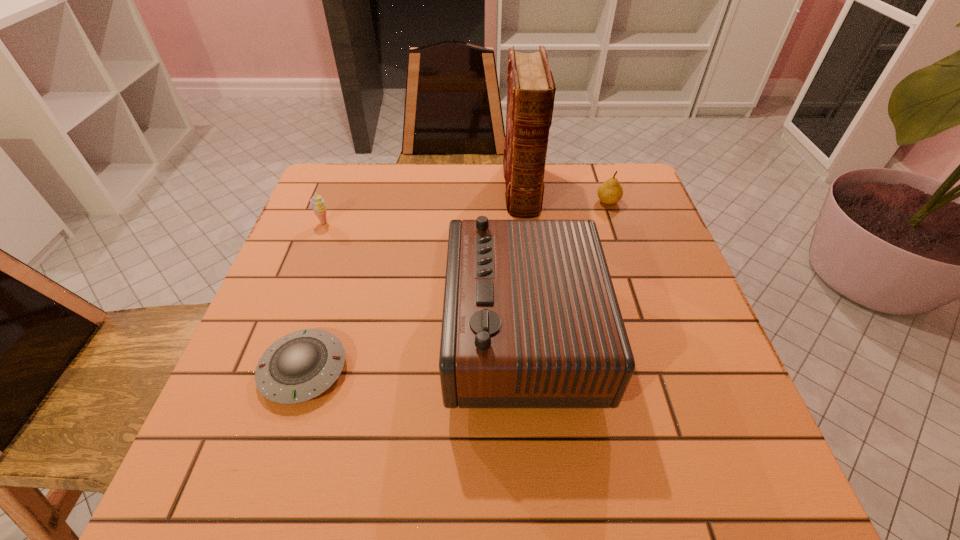
This screenshot has width=960, height=540. I want to click on hardback book, so click(x=531, y=89).

Where is `radio receiver`? radio receiver is located at coordinates (530, 319).

Where is `pear`? Image resolution: width=960 pixels, height=540 pixels. pear is located at coordinates 610,192.

Where is `sherbert`? The width and height of the screenshot is (960, 540). sherbert is located at coordinates click(x=317, y=204).

Locate an element on the screen. The height and width of the screenshot is (540, 960). saucer is located at coordinates (300, 366).

Identify the location of free region located on the spine side of the hardback book. This screenshot has height=540, width=960. (527, 242).

The image size is (960, 540). Identify the location of vacant space located 0.090m on the front panel of the second tallest object. (405, 333).

The image size is (960, 540). What are the coordinates of `vacant region located on the front panel of the second tallest object` in the screenshot? It's located at (391, 333).

Locate an element on the screen. free space located on the front panel of the second tallest object is located at coordinates (301, 333).

I want to click on vacant point located 0.060m on the back of the pear, so click(601, 182).